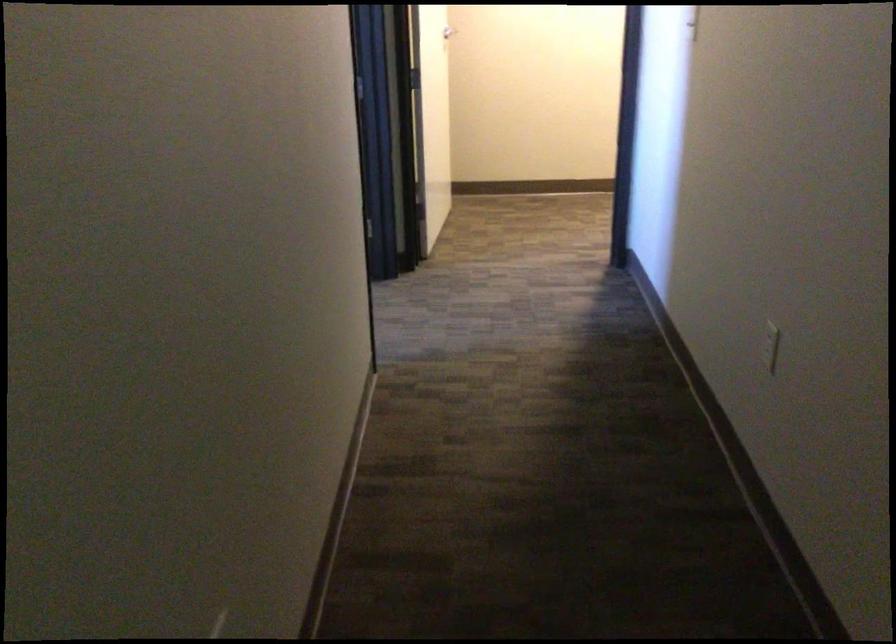
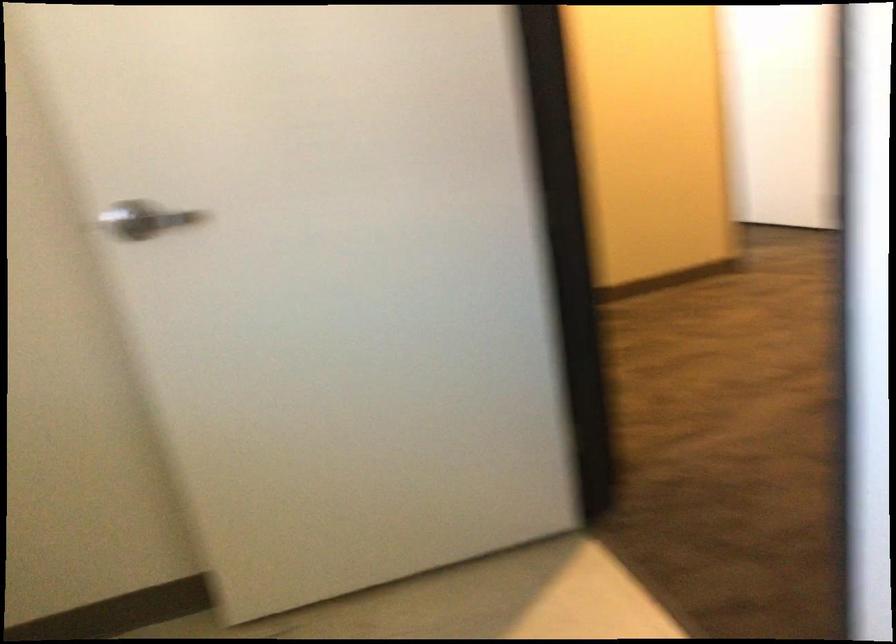
Question: What movement of the cameraman would produce the second image?

Choices:
 (A) Left
 (B) Right
 (C) Forward
 (D) Backward

Answer: (D)